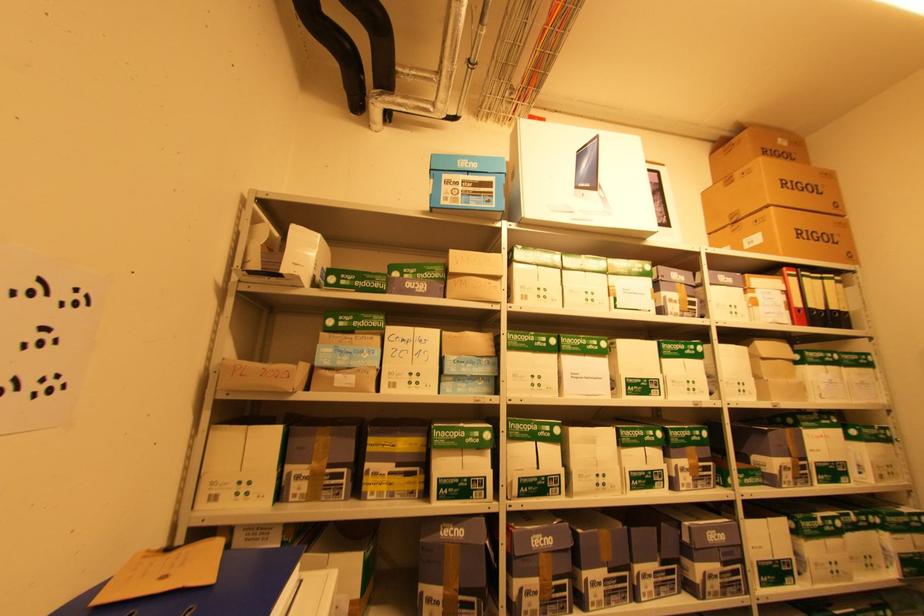
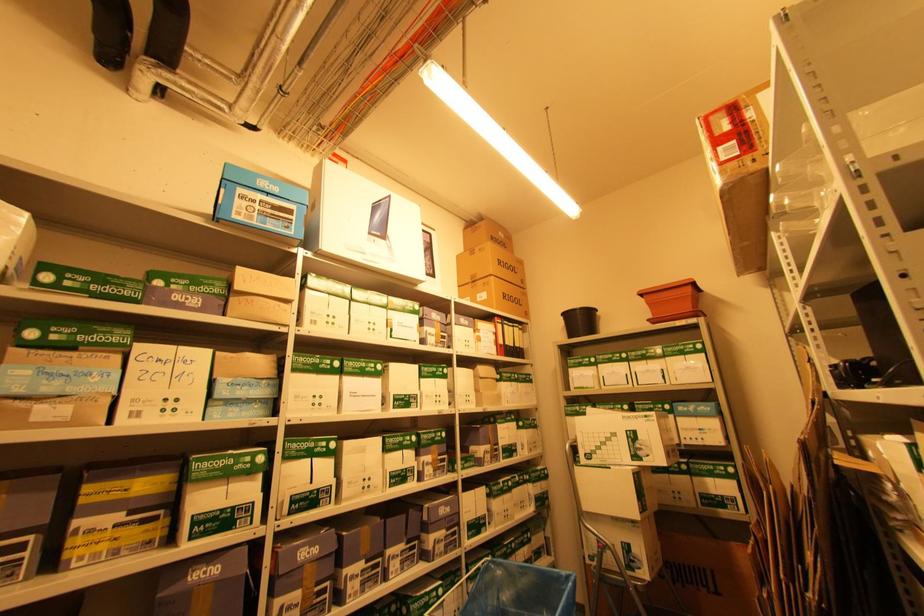
Question: The camera is either moving clockwise (left) or counter-clockwise (right) around the object. The first image is from the beginning of the video and the second image is from the end. Is the camera moving left or right when shooting the video?

Choices:
 (A) Left
 (B) Right

Answer: (A)